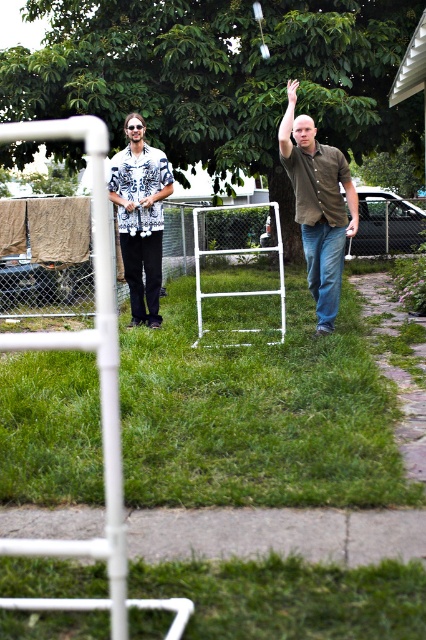
Based on the photo, you are standing at the edge of the grassy yard near the chain link fence. You want to walk to the green grass at center. Which direction should you walk?

You should walk towards the center of the yard to reach the green grass at center.

You are standing in the middle of the yard and see the green grass at center and the brown matte shirt at center. Which object is positioned to the right?

The brown matte shirt at center is positioned to the right of the green grass at center.